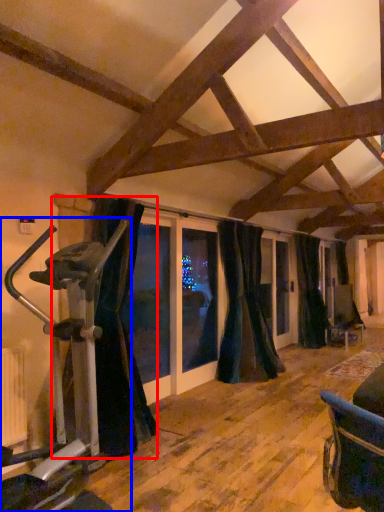
Question: Which of the following is the closest to the observer, curtain (highlighted by a red box) or stationary bicycle (highlighted by a blue box)?

Choices:
 (A) curtain
 (B) stationary bicycle

Answer: (B)